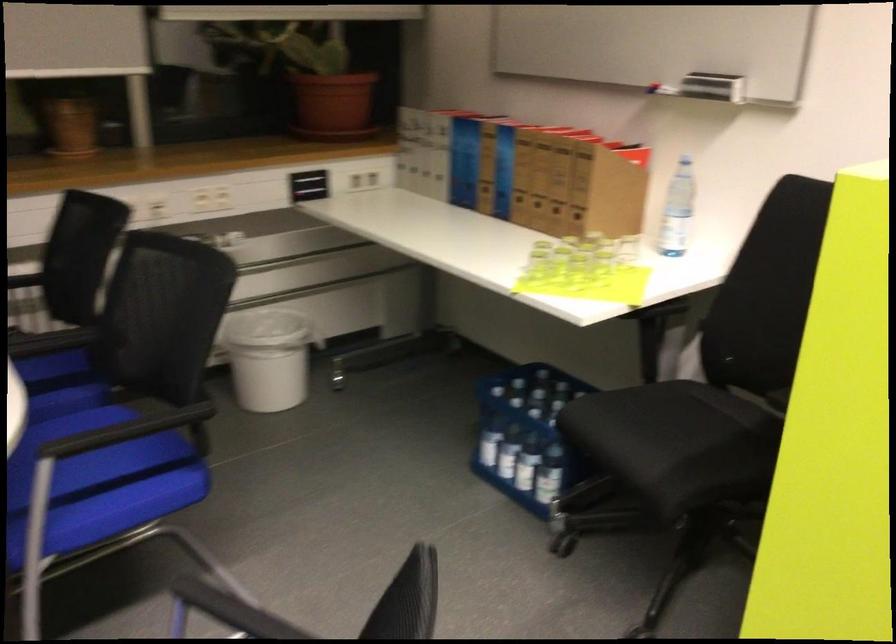
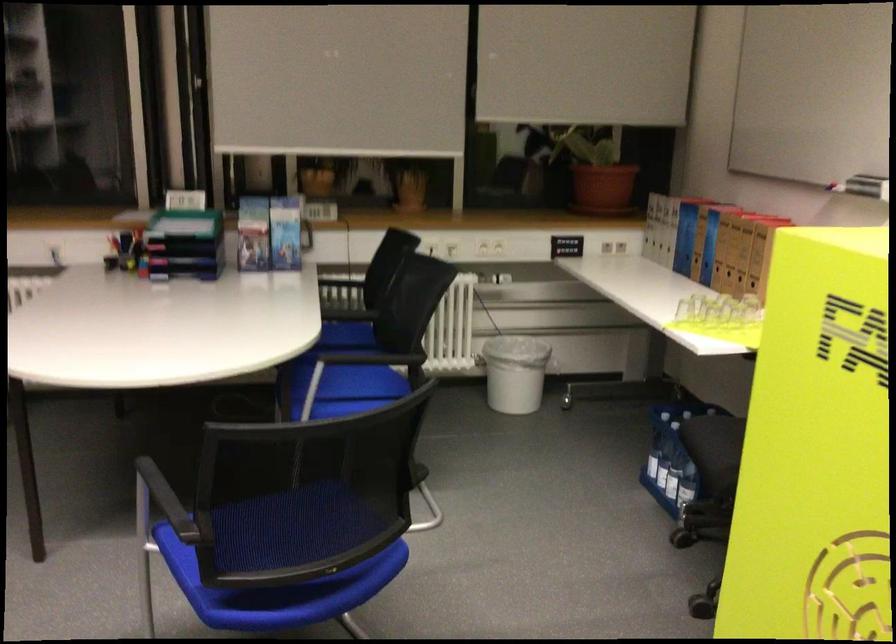
Find the pixel in the second image that matches pixel 339 111 in the first image.

(602, 187)